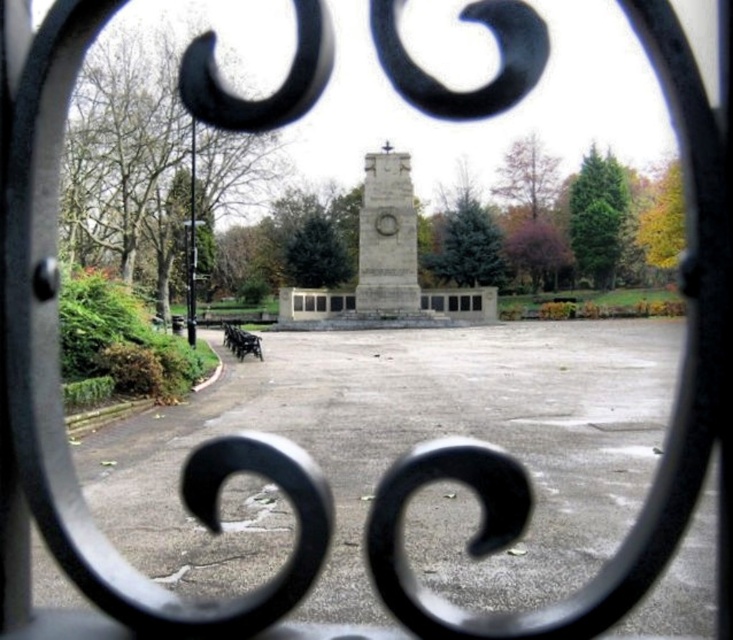
Can you confirm if gray concrete parking lot at center is positioned to the left of granite stone monument at center?

Incorrect, gray concrete parking lot at center is not on the left side of granite stone monument at center.

The height and width of the screenshot is (640, 733). What are the coordinates of `gray concrete parking lot at center` in the screenshot? It's located at (399, 452).